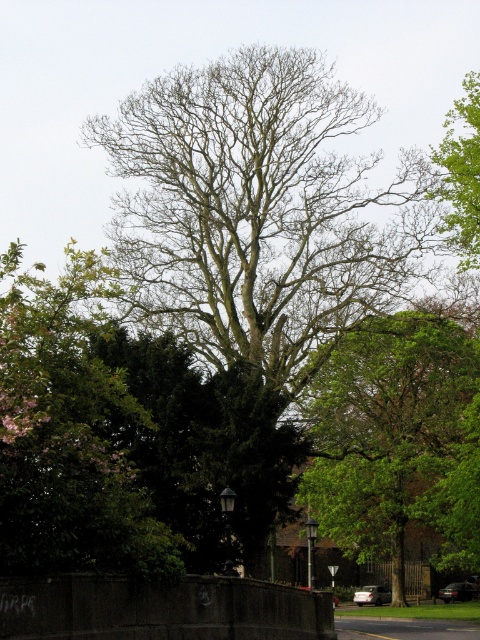
You are a bird looking for a place to perch. You see the bare branches at center and the green leafy tree at center. Which one is closer to the left side of the scene?

The bare branches at center is to the left of green leafy tree at center, so it is closer to the left side of the scene.

You are standing at the center of the image and want to locate the bare branches at center. According to the coordinates provided, where exactly should you look?

The bare branches at center are located at the coordinates point (259, 212).

You are an artist planning to sketch the scene. You want to ensure the bare branches at center and the green leafy tree at upper right are proportionally accurate. Which object should you draw larger in your sketch?

The bare branches at center should be drawn larger than the green leafy tree at upper right because the bare branches at center has a larger size compared to green leafy tree at upper right according to the description.